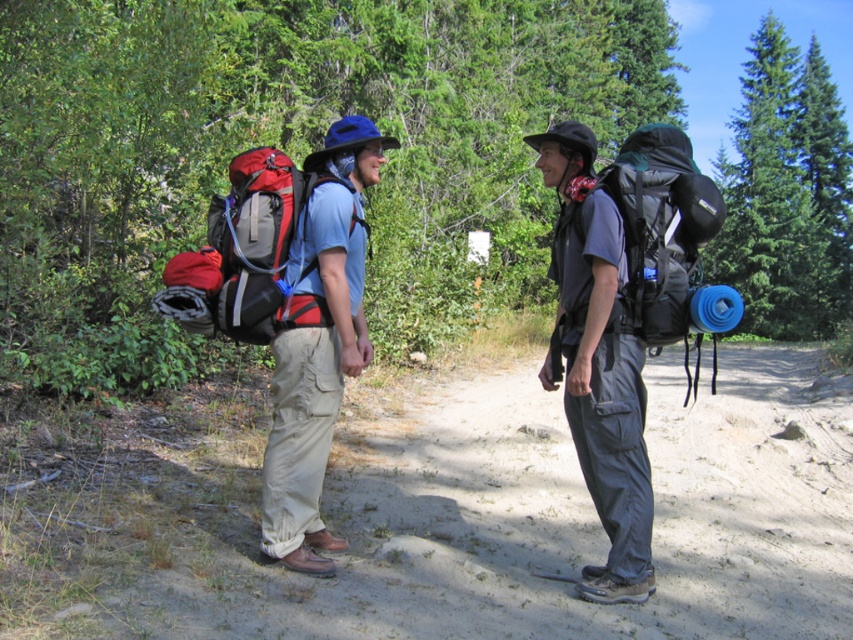
Question: Estimate the real-world distances between objects in this image. Which object is farther from the gray fabric backpack at center?

Choices:
 (A) matte black backpack at left
 (B) dirt track at center

Answer: (B)

Question: Is gray fabric backpack at center to the left of matte black backpack at left from the viewer's perspective?

Choices:
 (A) yes
 (B) no

Answer: (B)

Question: Among these objects, which one is farthest from the camera?

Choices:
 (A) matte blue backpack at center
 (B) dirt track at center

Answer: (A)

Question: Does gray fabric backpack at center have a lesser width compared to matte black backpack at left?

Choices:
 (A) no
 (B) yes

Answer: (B)

Question: Can you confirm if gray fabric backpack at center is thinner than matte black backpack at left?

Choices:
 (A) yes
 (B) no

Answer: (A)

Question: Which of the following is the farthest from the observer?

Choices:
 (A) matte blue backpack at center
 (B) dirt track at center
 (C) gray fabric backpack at center
 (D) matte black backpack at left

Answer: (A)